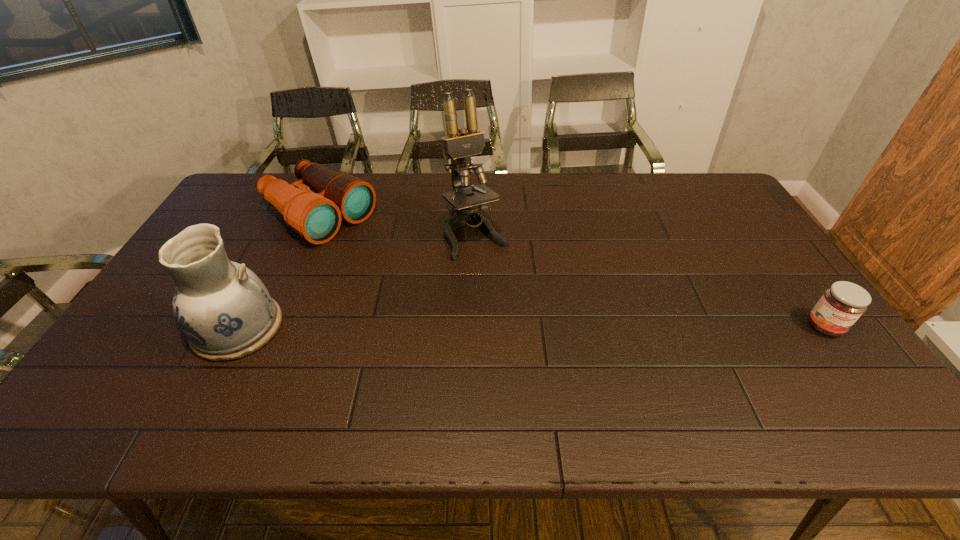
Where is `the third shortest object`? The width and height of the screenshot is (960, 540). the third shortest object is located at coordinates (223, 308).

Identify the location of the rightmost object. (841, 305).

This screenshot has width=960, height=540. Find the location of `the shortest object`. the shortest object is located at coordinates (841, 305).

At what (x,y) coordinates should I click in order to perform the action: click on the tallest object. Please return your answer as a coordinate pair (x, y). Looking at the image, I should click on (460, 145).

The height and width of the screenshot is (540, 960). Find the location of `the second object from right to left`. the second object from right to left is located at coordinates (460, 145).

Locate an element on the screen. the second shortest object is located at coordinates (316, 217).

Find the location of `vacant space located on the right of the second tallest object`. vacant space located on the right of the second tallest object is located at coordinates (313, 327).

This screenshot has width=960, height=540. Find the location of `vacant area located on the left of the shortest object`. vacant area located on the left of the shortest object is located at coordinates (663, 326).

The width and height of the screenshot is (960, 540). I want to click on vacant space situated 0.270m at the eyepieces of the microscope, so click(530, 323).

Identify the location of vacant position located 0.050m at the eyepieces of the microscope. This screenshot has height=540, width=960. (495, 270).